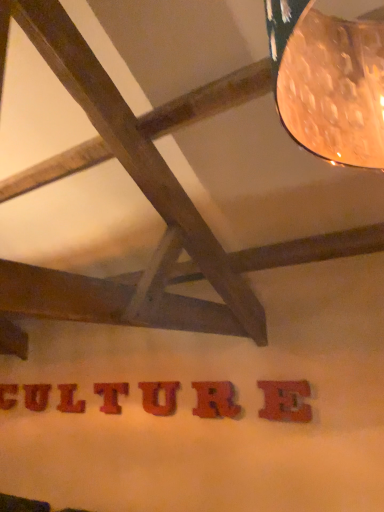
Question: From a real-world perspective, is rubberized red letter r at center, which appears as the 2th letter when viewed from the right, positioned above or below wooden letter u at center, acting as the 5th letter starting from the back?

Choices:
 (A) above
 (B) below

Answer: (A)

Question: In terms of height, does rubberized red letter r at center, the second letter positioned from the front, look taller or shorter compared to wooden letter u at center, acting as the third letter starting from the front?

Choices:
 (A) tall
 (B) short

Answer: (A)

Question: Which object is the closest to the matte red letter e at center, which is the first letter from front to back?

Choices:
 (A) rubberized red letter r at center, the second letter positioned from the front
 (B) red wood letter at lower center, marked as the first letter in a back-to-front arrangement
 (C) wooden textured letter t at center, which is the fourth letter in front-to-back order
 (D) red wood letter at center, arranged as the 2th letter when viewed from the back
 (E) red wood letter at center, acting as the fifth letter starting from the front

Answer: (A)

Question: Which object is positioned farthest from the red wood letter at center, arranged as the 6th letter when viewed from the right?

Choices:
 (A) rubberized red letter r at center, the second letter positioned from the front
 (B) wooden textured letter t at center, which ranks as the 4th letter in right-to-left order
 (C) red wood letter at lower center, placed as the 7th letter when sorted from front to back
 (D) matte red letter e at center, the 1th letter from the right
 (E) wooden letter u at center, marked as the 3th letter in a right-to-left arrangement

Answer: (D)